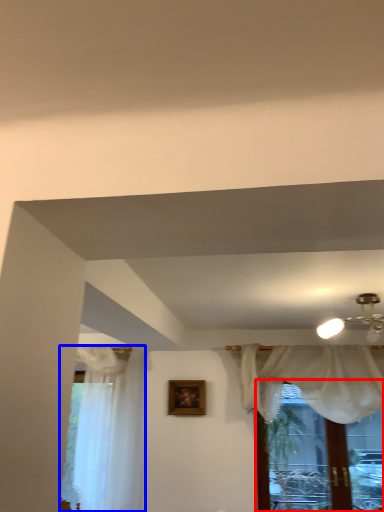
Question: Which of the following is the farthest to the observer, window (highlighted by a red box) or curtain (highlighted by a blue box)?

Choices:
 (A) window
 (B) curtain

Answer: (B)